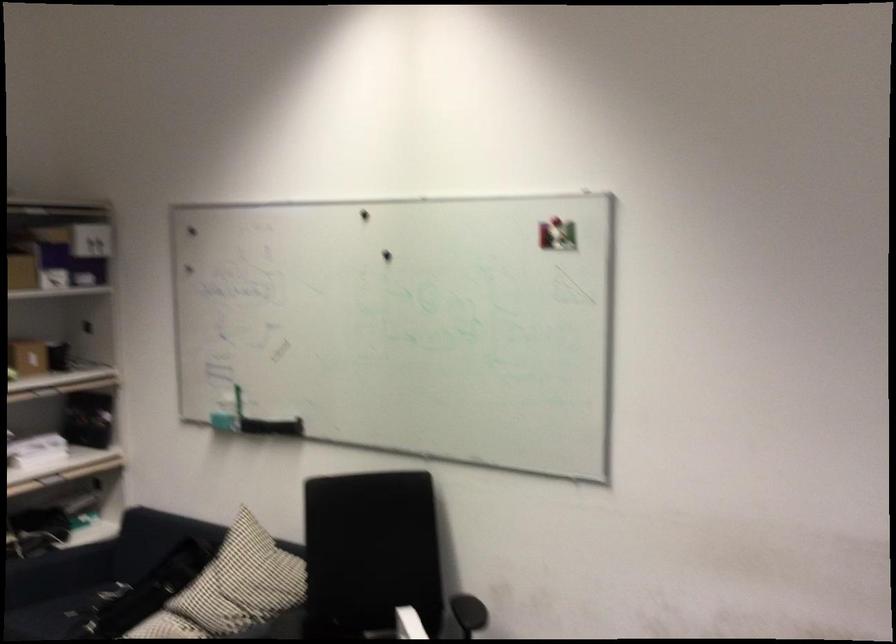
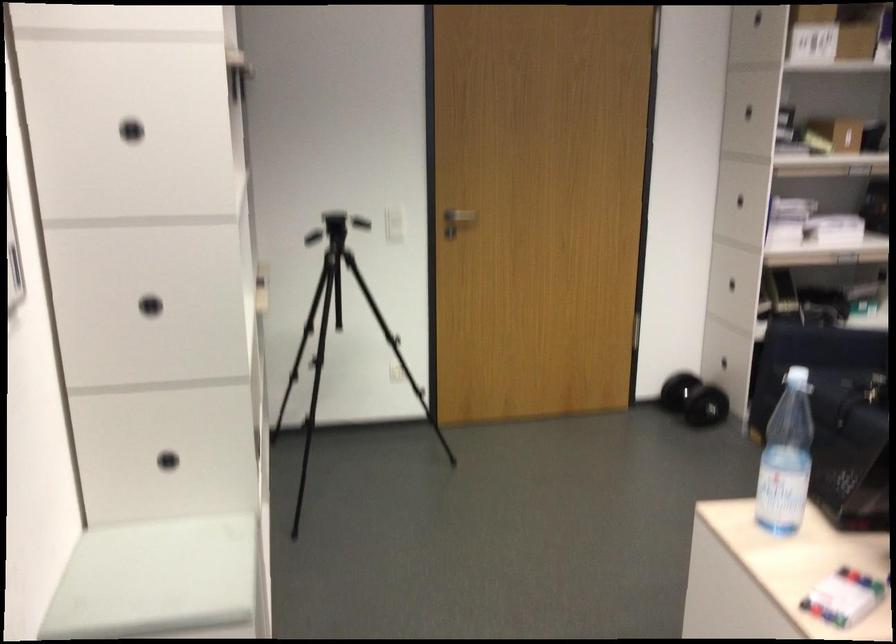
Question: The images are taken continuously from a first-person perspective. In which direction is your viewpoint rotating?

Choices:
 (A) Left
 (B) Right
 (C) Up
 (D) Down

Answer: (A)